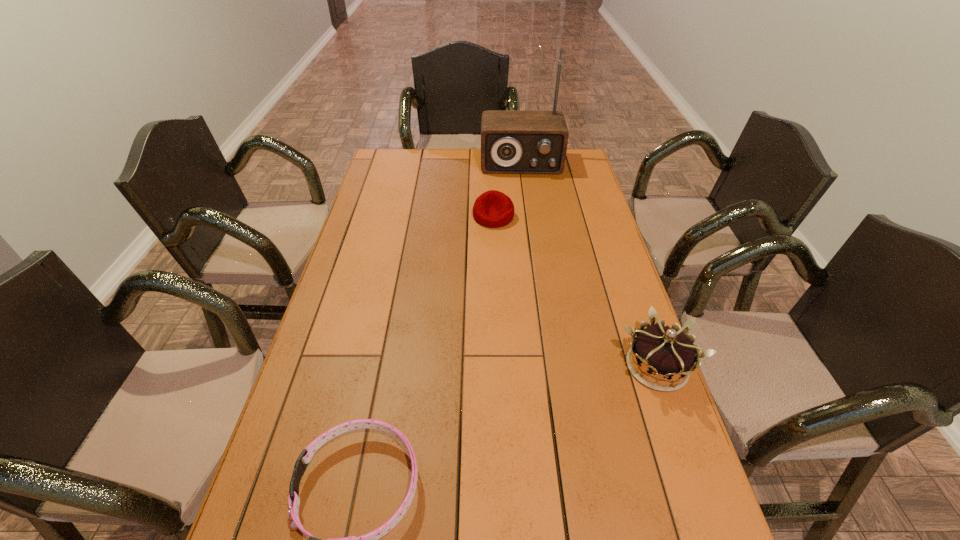
Locate an element on the screen. vacant point located on the front-facing side of the tallest object is located at coordinates (526, 216).

Where is `vacant space located 0.210m on the front-facing side of the tallest object`? vacant space located 0.210m on the front-facing side of the tallest object is located at coordinates (525, 206).

Identify the location of vacant area situated 0.330m on the front-facing side of the tallest object. (526, 224).

The width and height of the screenshot is (960, 540). I want to click on object situated at the far edge, so click(512, 141).

Identify the location of crown located in the right edge section of the desktop. Image resolution: width=960 pixels, height=540 pixels. (664, 352).

The width and height of the screenshot is (960, 540). Identify the location of radio receiver at the right edge. (512, 141).

Identify the location of object that is positioned at the far right corner. The image size is (960, 540). (512, 141).

This screenshot has width=960, height=540. In order to click on vacant space at the far edge of the desktop in this screenshot , I will do `click(427, 171)`.

You are a GUI agent. You are given a task and a screenshot of the screen. Output one action in this format:
    pyautogui.click(x=<x>, y=<y>)
    Task: Click on the free location at the left edge
    The image size is (960, 540).
    Given the screenshot: What is the action you would take?
    pyautogui.click(x=339, y=393)

Where is `vacant space at the right edge of the desktop`? This screenshot has height=540, width=960. vacant space at the right edge of the desktop is located at coordinates (584, 212).